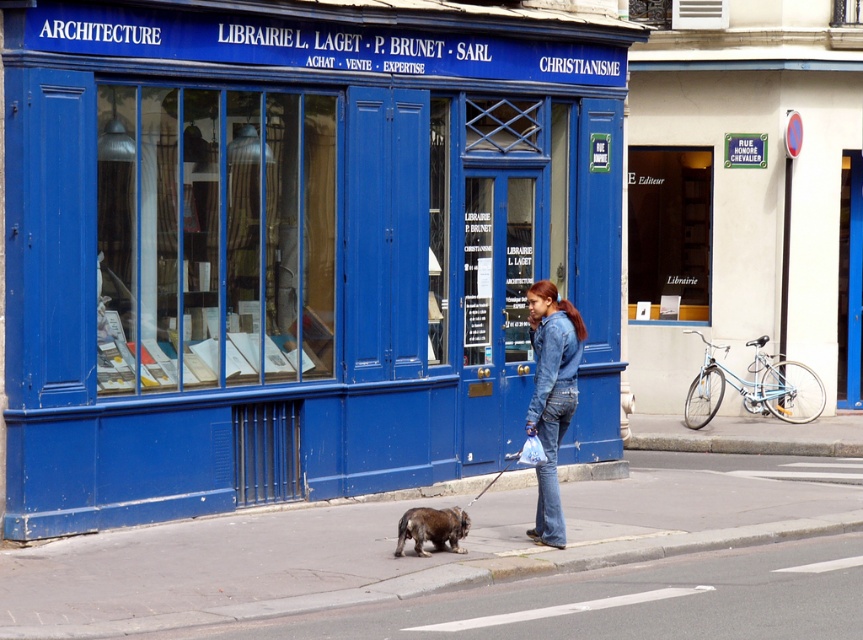
Question: Which object is farther from the camera taking this photo?

Choices:
 (A) brown fur dog at center
 (B) smooth concrete sidewalk at center
 (C) blue painted building at center

Answer: (C)

Question: Estimate the real-world distances between objects in this image. Which object is closer to the smooth concrete sidewalk at center?

Choices:
 (A) brown fur dog at center
 (B) blue painted building at center
 (C) denim jacket at center

Answer: (B)

Question: Can you confirm if smooth concrete sidewalk at center is positioned to the right of denim jacket at center?

Choices:
 (A) no
 (B) yes

Answer: (A)

Question: Does blue painted building at center come behind denim jacket at center?

Choices:
 (A) no
 (B) yes

Answer: (A)

Question: Which object appears closest to the camera in this image?

Choices:
 (A) smooth concrete sidewalk at center
 (B) blue painted building at center

Answer: (A)

Question: Is smooth concrete sidewalk at center closer to the viewer compared to brown fur dog at center?

Choices:
 (A) no
 (B) yes

Answer: (B)